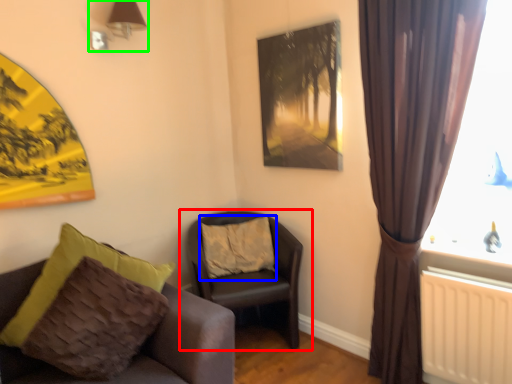
Question: Which is nearer to the chair (highlighted by a red box)? pillow (highlighted by a blue box) or lamp (highlighted by a green box).

Choices:
 (A) pillow
 (B) lamp

Answer: (A)